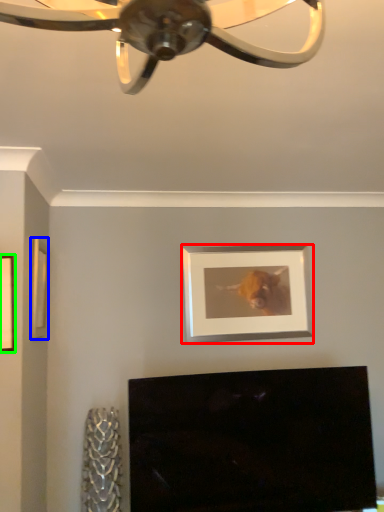
Question: Which object is the farthest from picture frame (highlighted by a red box)? Choose among these: picture frame (highlighted by a blue box) or picture frame (highlighted by a green box).

Choices:
 (A) picture frame
 (B) picture frame

Answer: (B)